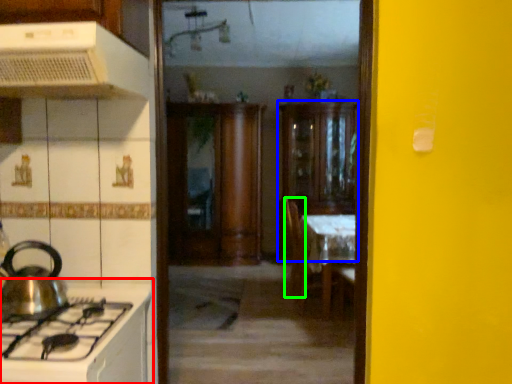
Question: Estimate the real-world distances between objects in this image. Which object is farther from countertop (highlighted by a red box), cabinetry (highlighted by a blue box) or chair (highlighted by a green box)?

Choices:
 (A) cabinetry
 (B) chair

Answer: (A)